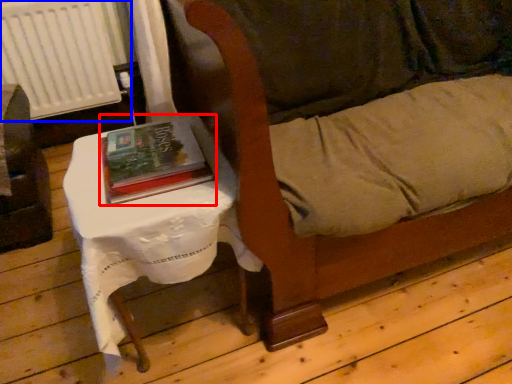
Question: Among these objects, which one is farthest to the camera, book (highlighted by a red box) or radiator (highlighted by a blue box)?

Choices:
 (A) book
 (B) radiator

Answer: (B)